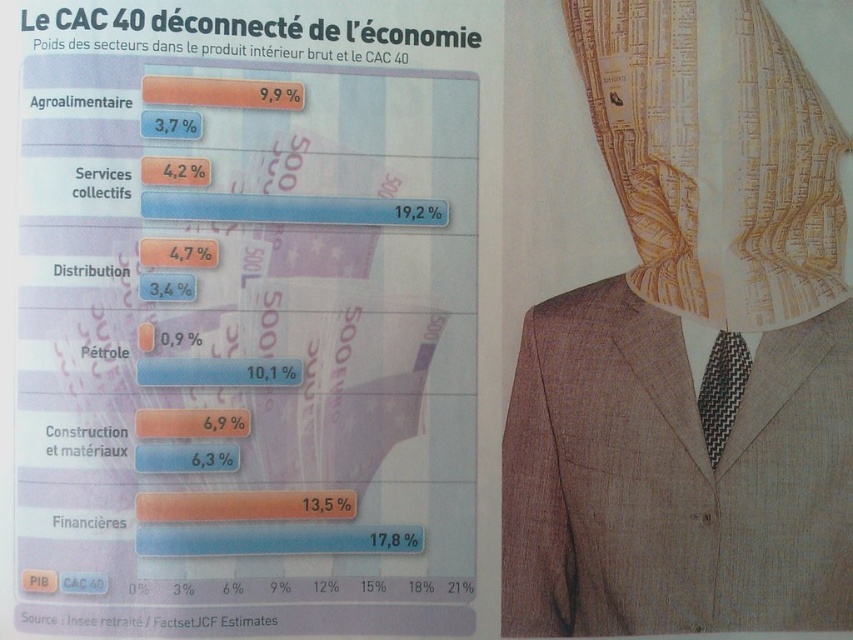
Question: Can you confirm if matte paper chart at upper left is wider than gold textured veil at upper right?

Choices:
 (A) no
 (B) yes

Answer: (B)

Question: Is light brown textured suit at right to the right of gold textured veil at upper right from the viewer's perspective?

Choices:
 (A) no
 (B) yes

Answer: (A)

Question: Estimate the real-world distances between objects in this image. Which object is farther from the matte paper chart at upper left?

Choices:
 (A) light brown textured suit at right
 (B) gold textured veil at upper right

Answer: (B)

Question: Which object appears farthest from the camera in this image?

Choices:
 (A) black checkered tie at center
 (B) gold textured veil at upper right

Answer: (A)

Question: Considering the relative positions of light brown textured suit at right and black checkered tie at center in the image provided, where is light brown textured suit at right located with respect to black checkered tie at center?

Choices:
 (A) above
 (B) below

Answer: (A)

Question: Which object is closer to the camera taking this photo?

Choices:
 (A) gold textured veil at upper right
 (B) light brown textured suit at right

Answer: (B)